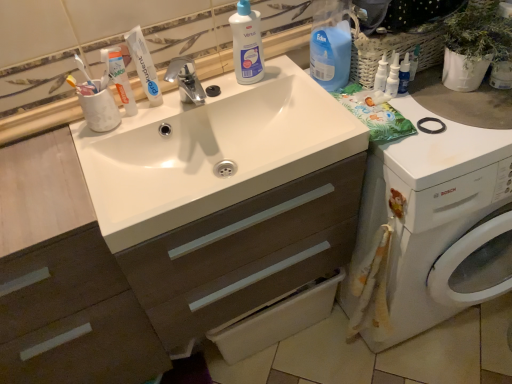
Where is `free spot above white plastic washing machine at right (from a real-world perspective)`? free spot above white plastic washing machine at right (from a real-world perspective) is located at coordinates (449, 115).